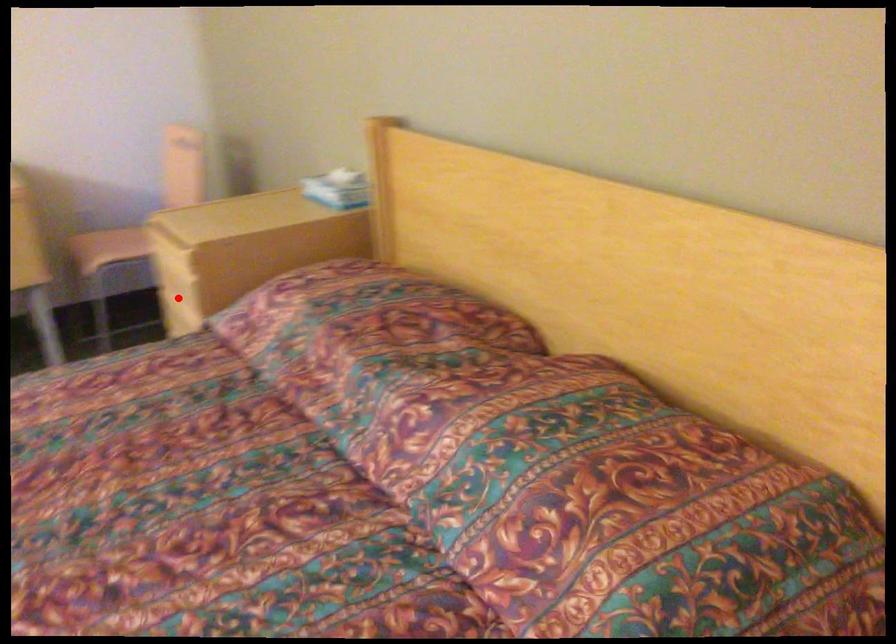
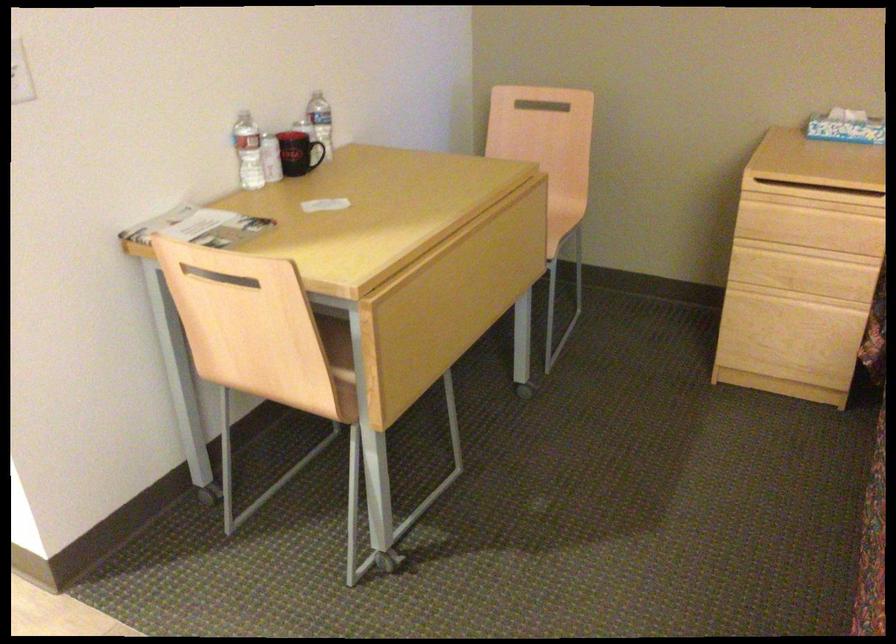
Where in the second image is the point corresponding to the highlighted location from the first image?

(810, 251)